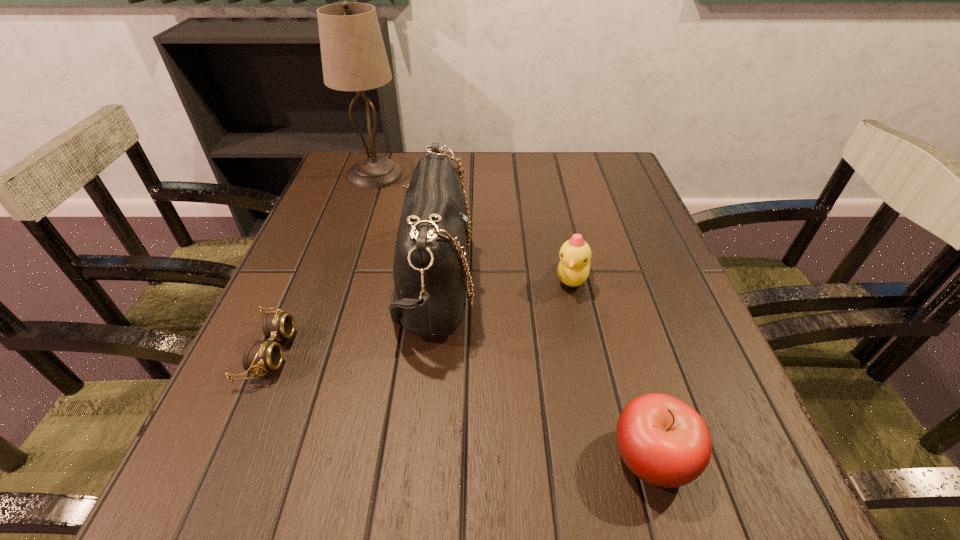
Identify the location of lampshade. (354, 58).

The width and height of the screenshot is (960, 540). In order to click on the tallest object in this screenshot , I will do `click(354, 58)`.

Image resolution: width=960 pixels, height=540 pixels. Identify the location of the third object from right to left. (430, 268).

I want to click on handbag, so click(x=430, y=268).

I want to click on duckling, so click(x=573, y=270).

This screenshot has height=540, width=960. What are the coordinates of `apple` in the screenshot? It's located at (663, 441).

You are a GUI agent. You are given a task and a screenshot of the screen. Output one action in this format:
    pyautogui.click(x=<x>, y=<y>)
    Task: Click on the goggles
    The height and width of the screenshot is (540, 960).
    Given the screenshot: What is the action you would take?
    pyautogui.click(x=259, y=356)

You are a GUI agent. You are given a task and a screenshot of the screen. Output one action in this format:
    pyautogui.click(x=<x>, y=<y>)
    Task: Click on the vacant region located on the front-facing side of the farthest object
    The width and height of the screenshot is (960, 540).
    Given the screenshot: What is the action you would take?
    pyautogui.click(x=535, y=174)

Locate an element on the screen. This screenshot has height=540, width=960. free space located at the front of the second tallest object with chain and zipper is located at coordinates (586, 282).

Find the location of a particular element. free region located on the front-facing side of the duckling is located at coordinates (611, 456).